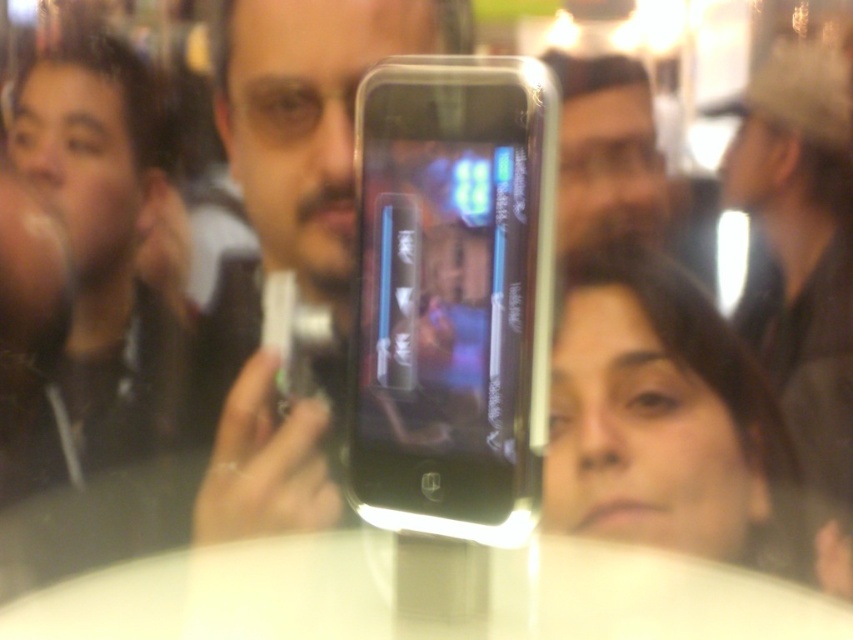
You are a photographer standing in front of the matte black phone at center and the white glossy round table at center. You want to take a photo that focuses on the phone while keeping the table in the background. Which object should be closer to the camera lens?

The matte black phone at center is closer to the camera lens than the white glossy round table at center, so focusing on it will naturally place the table in the background.